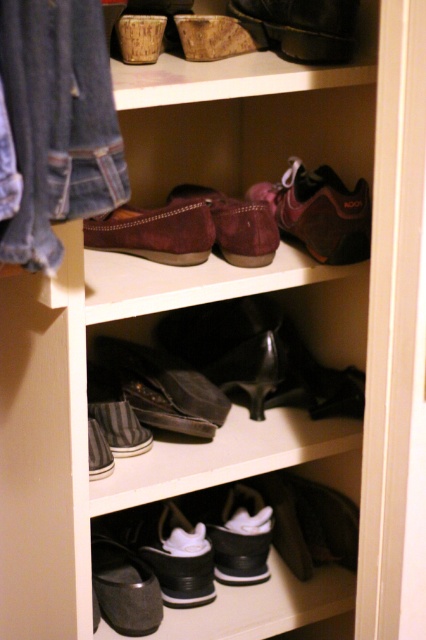
Question: Considering the real-world distances, which object is closest to the denim jeans at upper left?

Choices:
 (A) matte black shoe at lower center
 (B) leather boot at upper center

Answer: (A)

Question: Which point is farther from the camera taking this photo?

Choices:
 (A) (135, 577)
 (B) (368, 209)

Answer: (A)

Question: Does leather boot at upper center have a lesser width compared to matte black shoe at lower center?

Choices:
 (A) yes
 (B) no

Answer: (B)

Question: Can you confirm if leather boot at upper center is positioned below suede/matte moccasin at center?

Choices:
 (A) no
 (B) yes

Answer: (A)

Question: Is suede/maroon shoe at center thinner than suede/matte moccasin at center?

Choices:
 (A) yes
 (B) no

Answer: (A)

Question: Among these objects, which one is nearest to the camera?

Choices:
 (A) suede/matte shoe at center
 (B) dark gray suede shoe at lower left

Answer: (A)